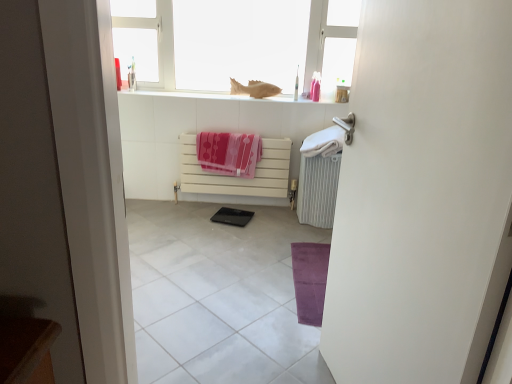
Locate an element on the screen. The height and width of the screenshot is (384, 512). vacant space in between black glossy pad at center and white matte radiator at center is located at coordinates (237, 205).